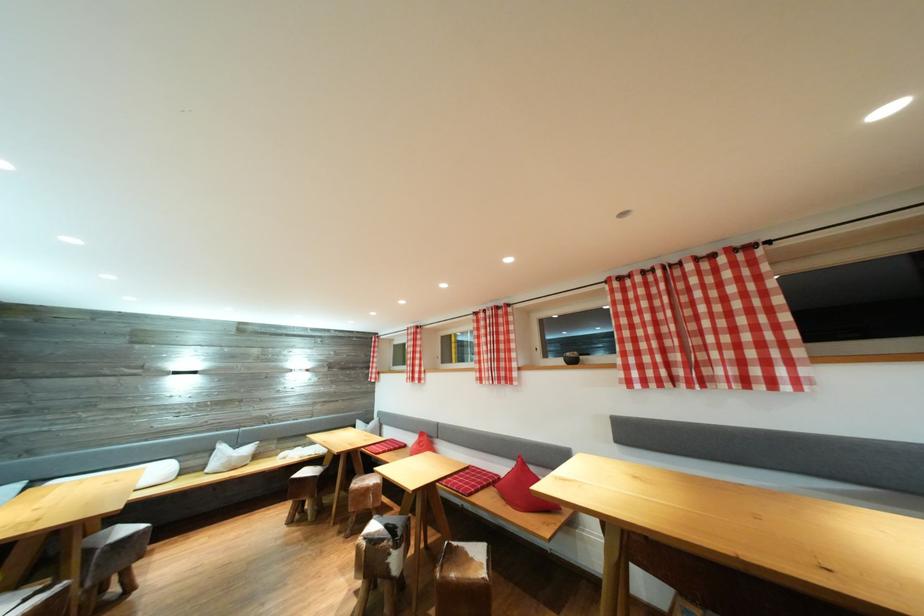
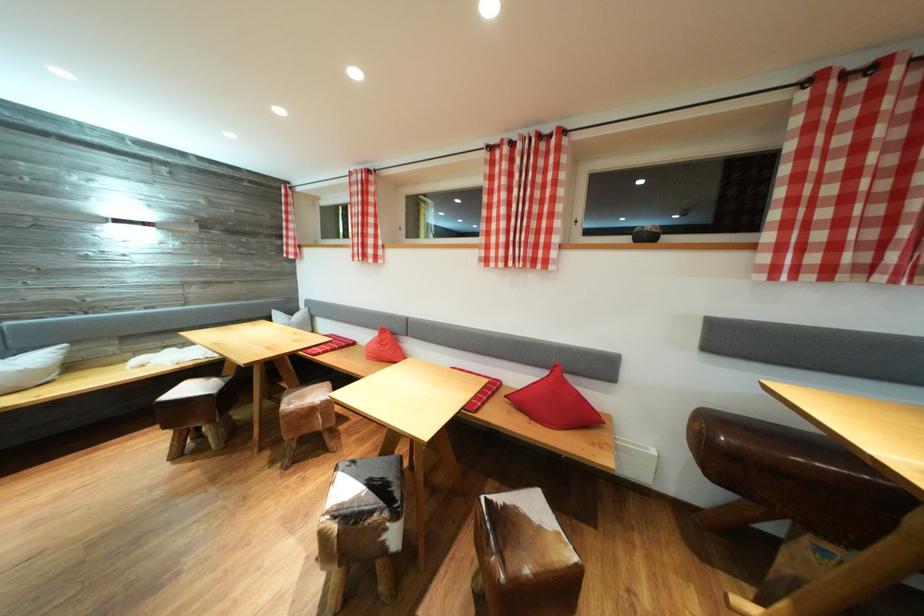
Where in the second image is the point corresponding to the point at 403,552 from the first image?

(403, 522)